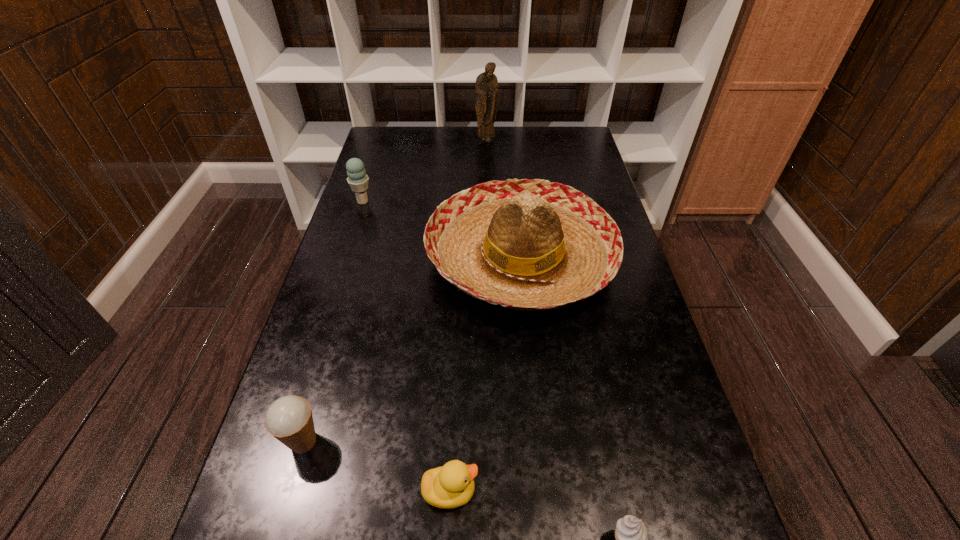
Where is `vacant space in between the fourth farthest object and the duckling`? Image resolution: width=960 pixels, height=540 pixels. vacant space in between the fourth farthest object and the duckling is located at coordinates (376, 467).

Where is `free space between the fifth farthest object and the farthest icecream`? free space between the fifth farthest object and the farthest icecream is located at coordinates (406, 346).

At what (x,y) coordinates should I click in order to perform the action: click on free space between the fifth shortest object and the shortest object. Please return your answer as a coordinate pair (x, y). The image size is (960, 540). Looking at the image, I should click on (486, 375).

The image size is (960, 540). Find the location of `free spot between the farthest icecream and the fourth farthest object`. free spot between the farthest icecream and the fourth farthest object is located at coordinates (333, 321).

Find the location of a particular element. This screenshot has height=540, width=960. the fourth closest object to the nearest icecream is located at coordinates (358, 180).

Locate which object is the second closest to the fourth farthest object. Please provide its 2D coordinates. Your answer should be formatted as a tuple, i.e. [(x, y)], where the tuple contains the x and y coordinates of a point satisfying the conditions above.

[(533, 245)]

Image resolution: width=960 pixels, height=540 pixels. Find the location of `icecream object that ranks as the closest to the farthest icecream`. icecream object that ranks as the closest to the farthest icecream is located at coordinates (289, 419).

Where is `icecream that is the third closest to the second nearest object`? Image resolution: width=960 pixels, height=540 pixels. icecream that is the third closest to the second nearest object is located at coordinates (358, 180).

You are a GUI agent. You are given a task and a screenshot of the screen. Output one action in this format:
    pyautogui.click(x=<x>, y=<y>)
    Task: Click on the vacant space that satisfies the following two spatial constraints: 1. on the back side of the sombrero; 2. on the right side of the fourth farthest object
    
    Given the screenshot: What is the action you would take?
    pyautogui.click(x=356, y=259)

What are the coordinates of `free location that satisfies the following two spatial constraints: 1. on the front side of the sombrero; 2. on the face of the shortest object` in the screenshot? It's located at (543, 491).